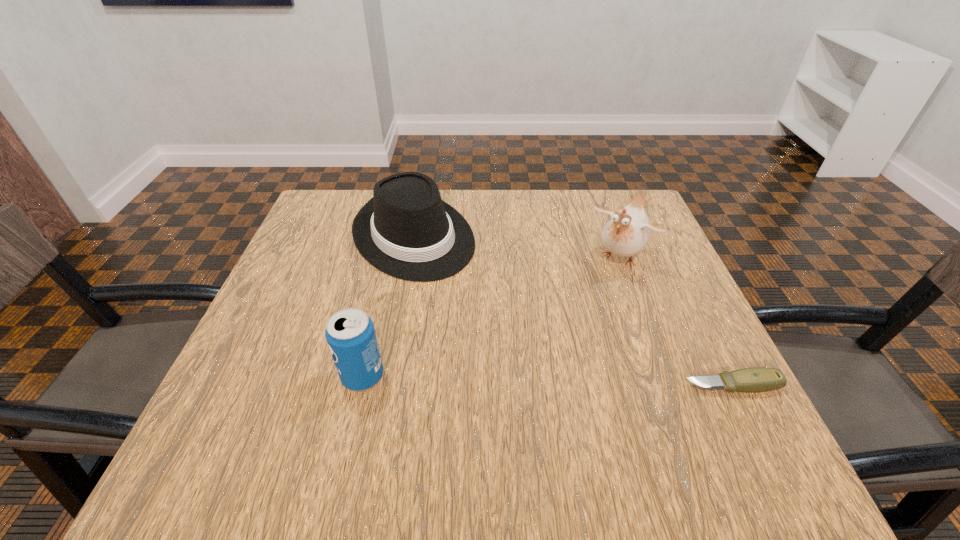
Locate an element on the screen. vacant space on the desktop that is between the soda can and the shortest object and is positioned at the beak of the bird is located at coordinates (534, 381).

Where is `free space on the desktop that is between the soda can and the shortest object and is positioned on the front-facing side of the fedora`? The image size is (960, 540). free space on the desktop that is between the soda can and the shortest object and is positioned on the front-facing side of the fedora is located at coordinates (540, 381).